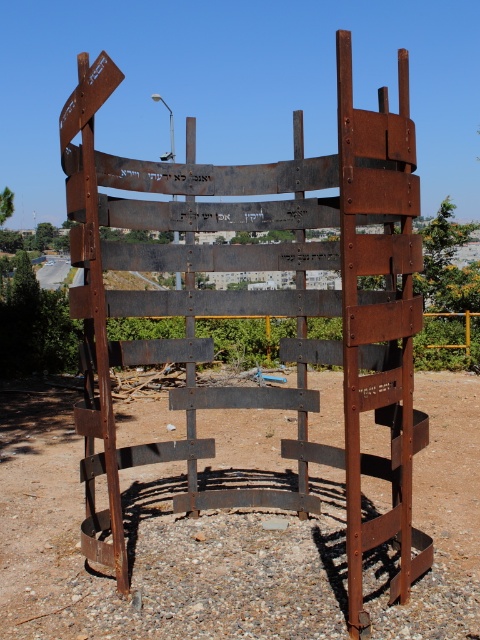
Question: Which point is closer to the camera taking this photo?

Choices:
 (A) (118, 252)
 (B) (324, 378)

Answer: (A)

Question: Which point appears farthest from the camera in this image?

Choices:
 (A) (241, 506)
 (B) (272, 608)

Answer: (A)

Question: Considering the relative positions of rusty metal sign at center and rusty metal structure at center in the image provided, where is rusty metal sign at center located with respect to rusty metal structure at center?

Choices:
 (A) above
 (B) below

Answer: (A)

Question: Is rusty metal sign at center in front of rusty metal structure at center?

Choices:
 (A) no
 (B) yes

Answer: (B)

Question: Is rusty metal sign at center thinner than rusty metal structure at center?

Choices:
 (A) no
 (B) yes

Answer: (A)